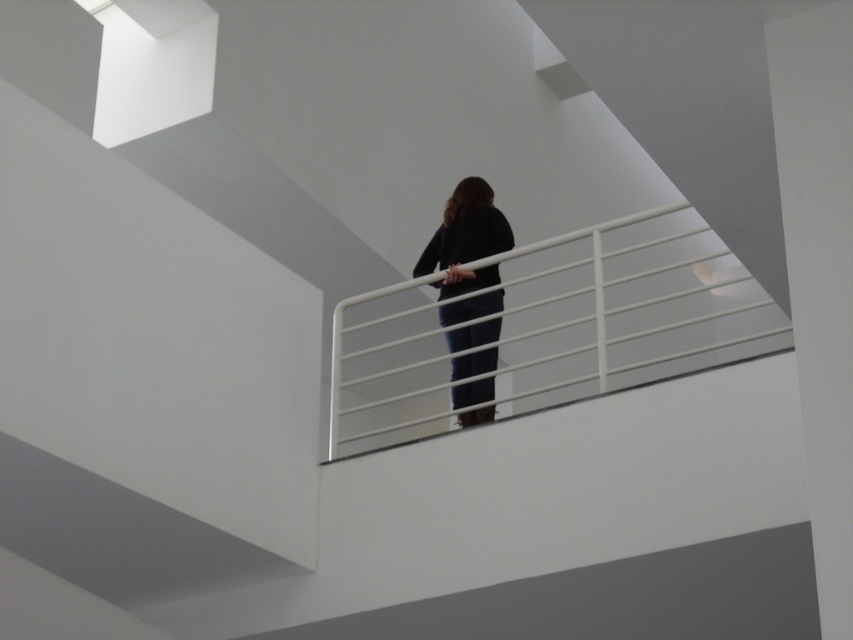
Question: Does white metal rail at upper center appear on the left side of black matte pants at center?

Choices:
 (A) yes
 (B) no

Answer: (B)

Question: Can you confirm if white metal rail at upper center is positioned to the left of black matte pants at center?

Choices:
 (A) yes
 (B) no

Answer: (B)

Question: Which of the following is the farthest from the observer?

Choices:
 (A) (532, 339)
 (B) (463, 417)

Answer: (A)

Question: In this image, where is white metal rail at upper center located relative to black matte pants at center?

Choices:
 (A) above
 (B) below

Answer: (A)